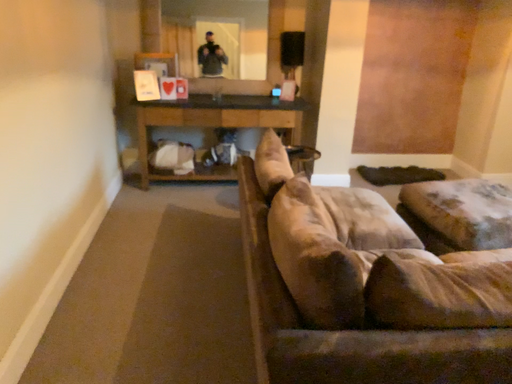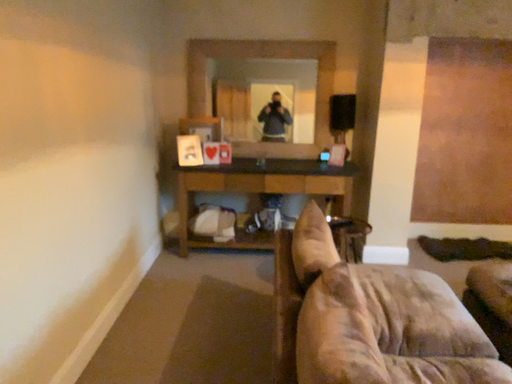
Question: How did the camera likely rotate when shooting the video?

Choices:
 (A) rotated upward
 (B) rotated downward

Answer: (A)